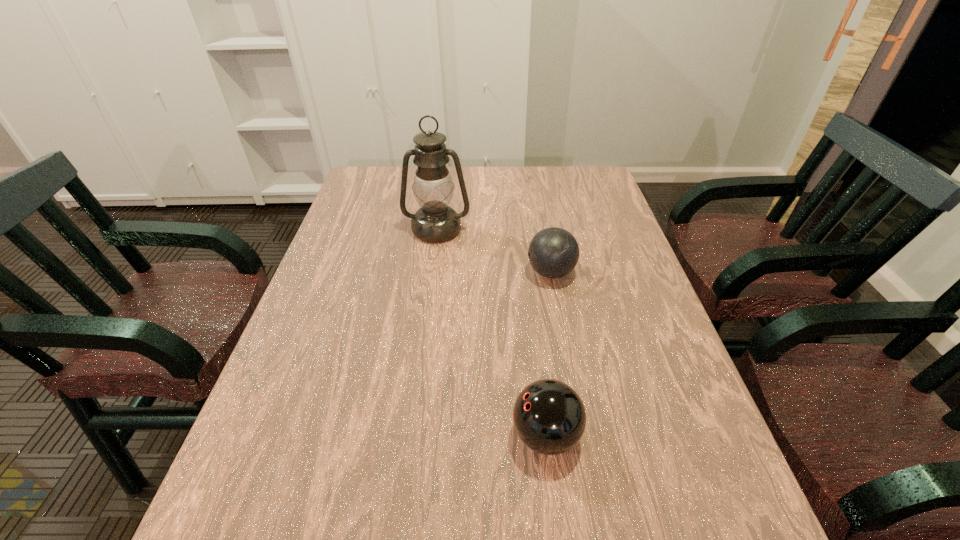
Locate an element on the screen. the farthest object is located at coordinates 435,221.

Find the location of `oil lamp`. oil lamp is located at coordinates (435, 221).

At what (x,y) coordinates should I click in order to perform the action: click on the farther bowling ball. Please return your answer as a coordinate pair (x, y). This screenshot has height=540, width=960. Looking at the image, I should click on (553, 252).

I want to click on the nearer bowling ball, so click(x=549, y=416).

Find the location of a particular element. This screenshot has width=960, height=540. free space located 0.180m on the right of the tallest object is located at coordinates (530, 230).

Locate an element on the screen. The height and width of the screenshot is (540, 960). free region located on the grip area of the second nearest object is located at coordinates (459, 272).

This screenshot has width=960, height=540. Identify the location of vacant space located 0.300m on the grip area of the second nearest object. (413, 272).

Find the location of a particular element. vacant area situated 0.070m on the grip area of the second nearest object is located at coordinates pos(500,272).

Where is `vacant space situated 0.080m on the surface of the nearest object near the finger holes`? vacant space situated 0.080m on the surface of the nearest object near the finger holes is located at coordinates (468, 435).

You are a GUI agent. You are given a task and a screenshot of the screen. Output one action in this format:
    pyautogui.click(x=<x>, y=<y>)
    Task: Click on the free space located 0.390m on the surface of the nearest object near the finger holes
    
    Given the screenshot: What is the action you would take?
    pyautogui.click(x=301, y=435)